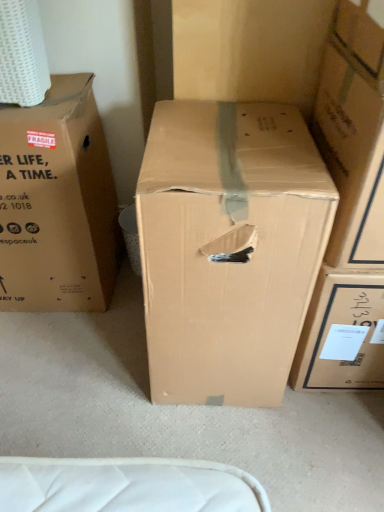
Question: Is brown cardboard box at left, positioned as the 1th box in left-to-right order, wider than brown cardboard box at center, positioned as the second box in left-to-right order?

Choices:
 (A) yes
 (B) no

Answer: (B)

Question: Can you confirm if brown cardboard box at left, positioned as the 1th box in left-to-right order, is positioned to the right of brown cardboard box at center, which is the 2th box from right to left?

Choices:
 (A) yes
 (B) no

Answer: (B)

Question: Does brown cardboard box at left, positioned as the 1th box in left-to-right order, come in front of brown cardboard box at center, positioned as the second box in left-to-right order?

Choices:
 (A) no
 (B) yes

Answer: (A)

Question: Can you confirm if brown cardboard box at left, positioned as the 1th box in left-to-right order, is taller than brown cardboard box at center, positioned as the second box in left-to-right order?

Choices:
 (A) yes
 (B) no

Answer: (B)

Question: Is brown cardboard box at center, which is the 2th box from right to left, located within brown cardboard box at left, positioned as the 1th box in left-to-right order?

Choices:
 (A) no
 (B) yes

Answer: (A)

Question: Is brown cardboard box at left, positioned as the 1th box in left-to-right order, at the left side of brown cardboard box at center, which is the 2th box from right to left?

Choices:
 (A) yes
 (B) no

Answer: (A)

Question: Is brown cardboard box at left, which is the 3th box from right to left, far from cardboard box at center, the 1th box viewed from the right?

Choices:
 (A) no
 (B) yes

Answer: (A)

Question: From a real-world perspective, is brown cardboard box at left, which is the 3th box from right to left, positioned under cardboard box at center, which appears as the 3th box when viewed from the left, based on gravity?

Choices:
 (A) yes
 (B) no

Answer: (A)

Question: Is brown cardboard box at left, positioned as the 1th box in left-to-right order, placed right next to cardboard box at center, the 1th box viewed from the right?

Choices:
 (A) no
 (B) yes

Answer: (A)

Question: Can you confirm if brown cardboard box at left, positioned as the 1th box in left-to-right order, is shorter than cardboard box at center, which appears as the 3th box when viewed from the left?

Choices:
 (A) no
 (B) yes

Answer: (A)

Question: Is brown cardboard box at left, which is the 3th box from right to left, closer to camera compared to cardboard box at center, the 1th box viewed from the right?

Choices:
 (A) no
 (B) yes

Answer: (A)

Question: From the image's perspective, is brown cardboard box at left, positioned as the 1th box in left-to-right order, on top of cardboard box at center, the 1th box viewed from the right?

Choices:
 (A) no
 (B) yes

Answer: (A)

Question: Is brown cardboard box at center, which is the 2th box from right to left, positioned before cardboard box at center, which appears as the 3th box when viewed from the left?

Choices:
 (A) yes
 (B) no

Answer: (B)